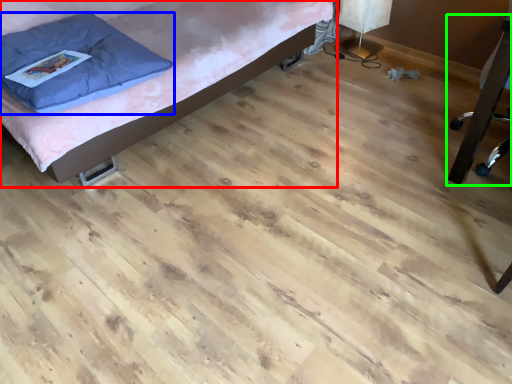
Question: Estimate the real-world distances between objects in this image. Which object is farther from furniture (highlighted by a red box), pillow (highlighted by a blue box) or furniture (highlighted by a green box)?

Choices:
 (A) pillow
 (B) furniture

Answer: (B)